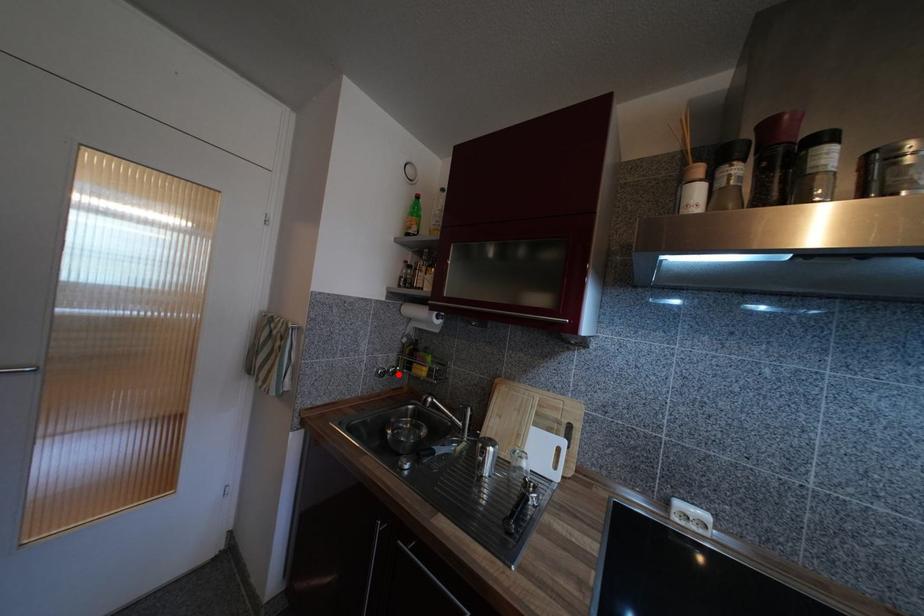
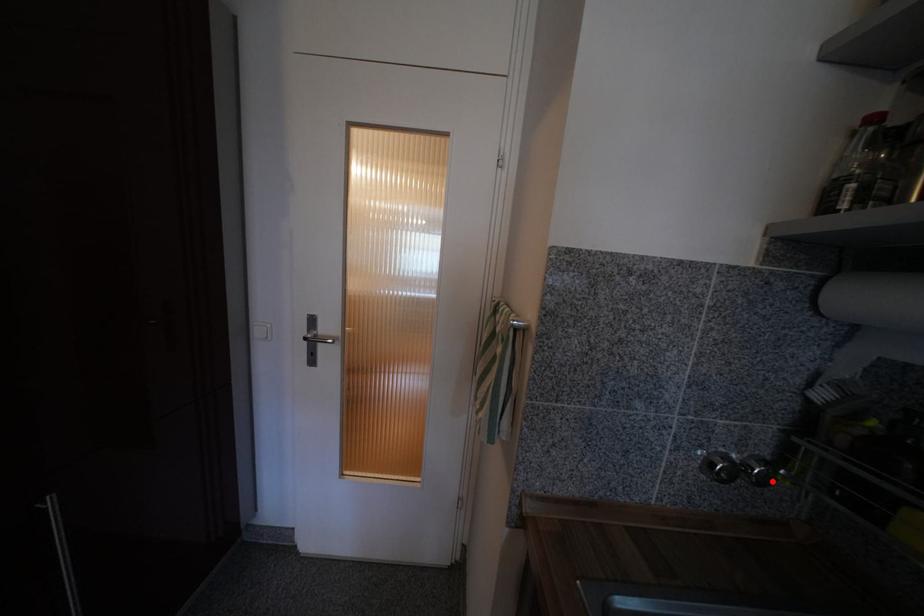
I am providing you with two images of the same scene from different viewpoints. A red point is marked on the first image and another point is marked on the second image. Is the marked point in image1 the same physical position as the marked point in image2?

Yes